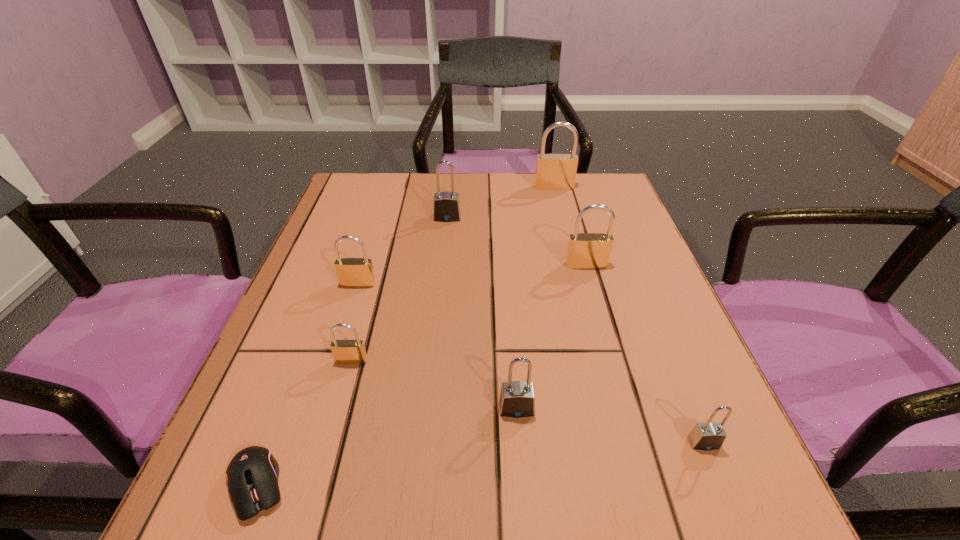
The height and width of the screenshot is (540, 960). I want to click on vacant region between the tallest object and the fourth farthest padlock, so click(x=456, y=235).

This screenshot has height=540, width=960. Identify the location of vacant area between the fourth nearest object and the third farthest object. (468, 313).

You are a GUI agent. You are given a task and a screenshot of the screen. Output one action in this format:
    pyautogui.click(x=<x>, y=<y>)
    Task: Click on the vacant area that lies between the farthest brass padlock and the rightmost object
    Image resolution: width=960 pixels, height=540 pixels.
    Given the screenshot: What is the action you would take?
    pyautogui.click(x=629, y=315)

The width and height of the screenshot is (960, 540). I want to click on vacant space in between the second nearest brass padlock and the third padlock from left to right, so click(402, 251).

This screenshot has width=960, height=540. Identify the location of free point between the rightmost gray padlock and the fifth object from right to left. (575, 330).

Identify which object is the third closest to the third nearest brass padlock. Please provide its 2D coordinates. Your answer should be formatted as a tuple, i.e. [(x, y)], where the tuple contains the x and y coordinates of a point satisfying the conditions above.

[(517, 399)]

The image size is (960, 540). In order to click on the sixth closest object to the third padlock from left to right in this screenshot , I will do `click(252, 475)`.

Identify the location of padlock that is the sixth nearest to the second nearest brass padlock. The width and height of the screenshot is (960, 540). (706, 436).

This screenshot has height=540, width=960. I want to click on the third closest padlock to the shortest object, so click(352, 272).

Choose which brass padlock is the nearest neighbor to the black computer mouse. Please provide its 2D coordinates. Your answer should be formatted as a tuple, i.e. [(x, y)], where the tuple contains the x and y coordinates of a point satisfying the conditions above.

[(344, 351)]